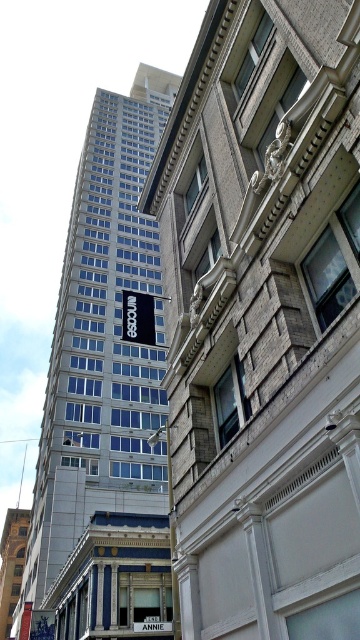
You are a city planner who needs to install a new streetlight between the black matte sign at upper center and the white plastic sign at center. The streetlight requires a minimum of 15 meters of space between the two signs to be installed safely. Based on the distance provided, can the streetlight be placed between them?

The black matte sign at upper center is 14.66 meters from the white plastic sign at center. Since the required minimum distance is 15 meters, the streetlight cannot be safely installed between them as the current distance is insufficient.

You are a city planner reviewing the city layout. You need to place a new streetlight such that it is exactly at the same location as the black matte sign at upper center. What coordinates should you use for the streetlight?

The coordinates for the black matte sign at upper center are at point (137,317), so you should place the streetlight at those coordinates.